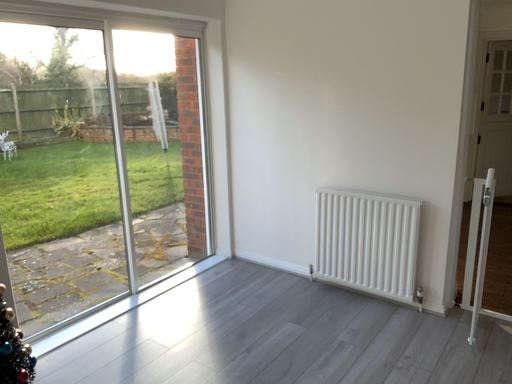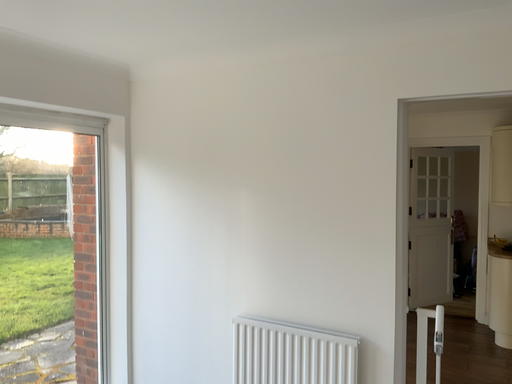
Question: How did the camera likely rotate when shooting the video?

Choices:
 (A) rotated upward
 (B) rotated downward

Answer: (A)